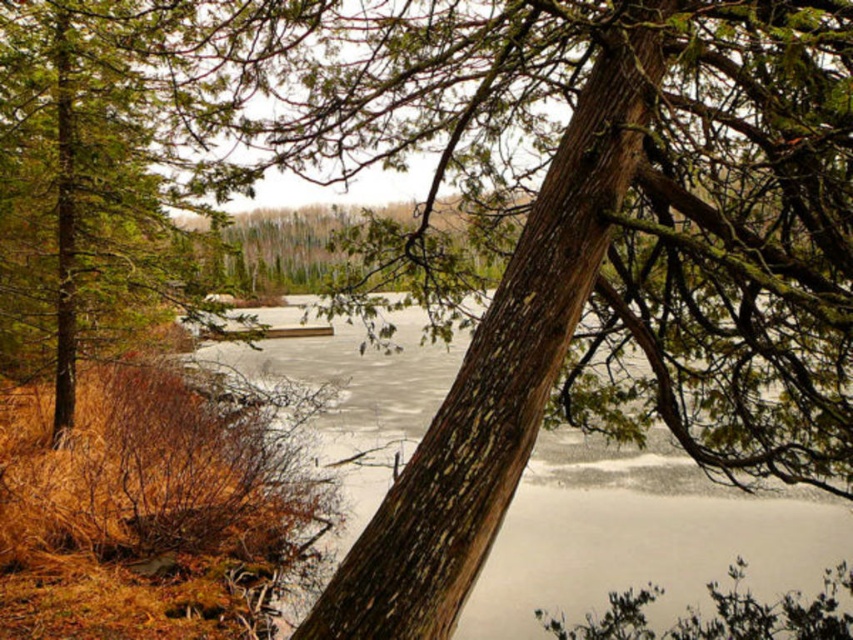
Who is lower down, frozen ice at center or green rough bark tree at left?

frozen ice at center

Which is behind, point (648, 467) or point (128, 16)?

Point (648, 467)

At what (x,y) coordinates should I click in order to perform the action: click on frozen ice at center. Please return your answer as a coordinate pair (x, y). The height and width of the screenshot is (640, 853). Looking at the image, I should click on (641, 534).